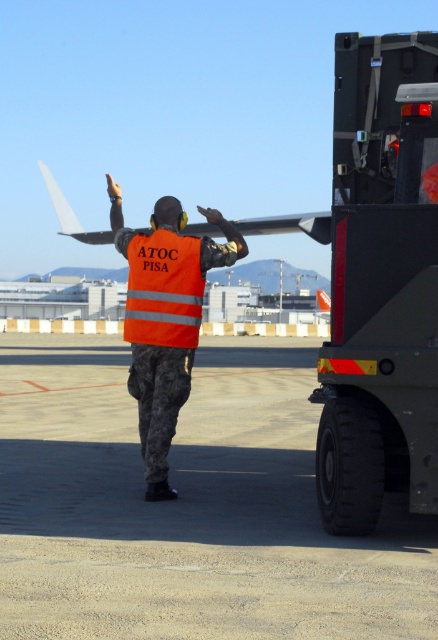
Looking at this image, between gray asphalt tarmac at lower center and reflective orange safety vest at center, which one has less height?

gray asphalt tarmac at lower center is shorter.

Is point (133, 486) farther from viewer compared to point (130, 243)?

That is True.

This screenshot has height=640, width=438. What are the coordinates of `gray asphalt tarmac at lower center` in the screenshot? It's located at (187, 506).

Consider the image. Who is taller, orange reflective vest at center or reflective orange safety vest at center?

orange reflective vest at center

Can you confirm if orange reflective vest at center is taller than reflective orange safety vest at center?

Yes, orange reflective vest at center is taller than reflective orange safety vest at center.

Describe the element at coordinates (165, 317) in the screenshot. I see `orange reflective vest at center` at that location.

Where is `orange reflective vest at center`? The width and height of the screenshot is (438, 640). orange reflective vest at center is located at coordinates (165, 317).

Does gray asphalt tarmac at lower center appear on the right side of orange reflective vest at center?

Incorrect, gray asphalt tarmac at lower center is not on the right side of orange reflective vest at center.

Is point (409, 612) less distant than point (163, 262)?

That is True.

You are a GUI agent. You are given a task and a screenshot of the screen. Output one action in this format:
    pyautogui.click(x=<x>, y=<y>)
    Task: Click on the gray asphalt tarmac at lower center
    The width and height of the screenshot is (438, 640).
    Given the screenshot: What is the action you would take?
    pyautogui.click(x=187, y=506)